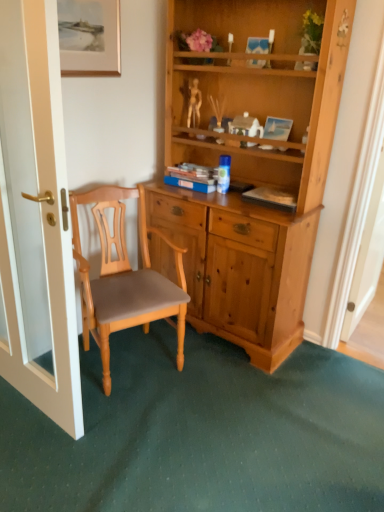
Question: Can you confirm if blue matte book at center is wider than gold-framed painting at upper left?

Choices:
 (A) no
 (B) yes

Answer: (B)

Question: Can you confirm if blue matte book at center is thinner than gold-framed painting at upper left?

Choices:
 (A) yes
 (B) no

Answer: (B)

Question: Can we say blue matte book at center lies outside gold-framed painting at upper left?

Choices:
 (A) yes
 (B) no

Answer: (A)

Question: Is blue matte book at center looking in the opposite direction of gold-framed painting at upper left?

Choices:
 (A) no
 (B) yes

Answer: (A)

Question: From a real-world perspective, does blue matte book at center sit lower than gold-framed painting at upper left?

Choices:
 (A) no
 (B) yes

Answer: (B)

Question: Is white glossy door at left wider or thinner than gold-framed painting at upper left?

Choices:
 (A) thin
 (B) wide

Answer: (B)

Question: Considering their positions, is white glossy door at left located in front of or behind gold-framed painting at upper left?

Choices:
 (A) front
 (B) behind

Answer: (A)

Question: Is white glossy door at left inside or outside of gold-framed painting at upper left?

Choices:
 (A) outside
 (B) inside

Answer: (A)

Question: Is white glossy door at left taller or shorter than gold-framed painting at upper left?

Choices:
 (A) short
 (B) tall

Answer: (B)

Question: Which is correct: blue matte book at center is inside light brown wood chair at center, or outside of it?

Choices:
 (A) inside
 (B) outside

Answer: (B)

Question: From a real-world perspective, is blue matte book at center above or below light brown wood chair at center?

Choices:
 (A) above
 (B) below

Answer: (A)

Question: Considering the relative positions of blue matte book at center and light brown wood chair at center in the image provided, is blue matte book at center to the left or to the right of light brown wood chair at center?

Choices:
 (A) right
 (B) left

Answer: (A)

Question: From the image's perspective, relative to light brown wood chair at center, is blue matte book at center above or below?

Choices:
 (A) below
 (B) above

Answer: (B)

Question: In terms of width, does white glossy door at left look wider or thinner when compared to blue glossy coffee cup at center?

Choices:
 (A) thin
 (B) wide

Answer: (B)

Question: Considering the positions of white glossy door at left and blue glossy coffee cup at center in the image, is white glossy door at left taller or shorter than blue glossy coffee cup at center?

Choices:
 (A) tall
 (B) short

Answer: (A)